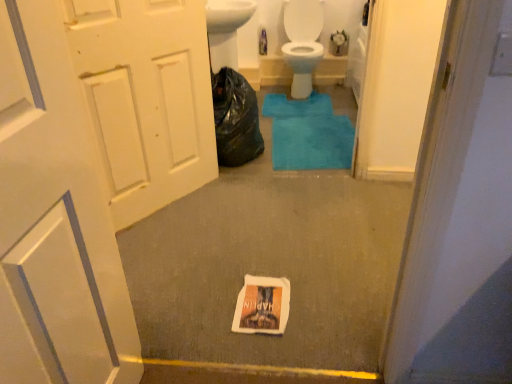
Locate an element on the screen. The image size is (512, 384). vacant space to the left of white paper flyer at center is located at coordinates (207, 302).